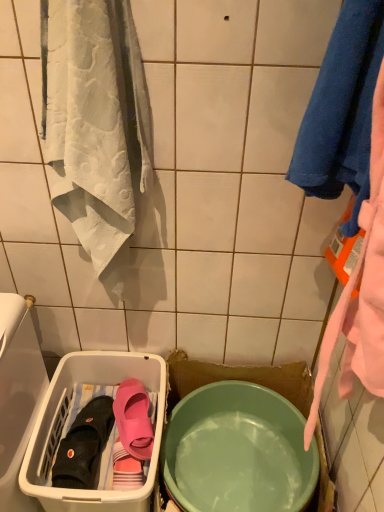
Question: From the image's perspective, relative to white plastic laundry basket at lower left, is matte green bowl at center above or below?

Choices:
 (A) below
 (B) above

Answer: (B)

Question: Does point (284, 506) appear closer or farther from the camera than point (57, 423)?

Choices:
 (A) farther
 (B) closer

Answer: (B)

Question: Considering the real-world distances, which object is closest to the black rubber boot at lower left, the first footwear when ordered from left to right?

Choices:
 (A) matte green bowl at center
 (B) white plastic laundry basket at lower left
 (C) pink rubber slipper at lower left, which is the 2th footwear in left-to-right order
 (D) blue soft towel at upper right

Answer: (C)

Question: Which of these objects is positioned closest to the blue soft towel at upper right?

Choices:
 (A) white plastic laundry basket at lower left
 (B) pink rubber slipper at lower left, which is the 1th footwear in right-to-left order
 (C) matte green bowl at center
 (D) black rubber boot at lower left, the first footwear when ordered from left to right

Answer: (C)